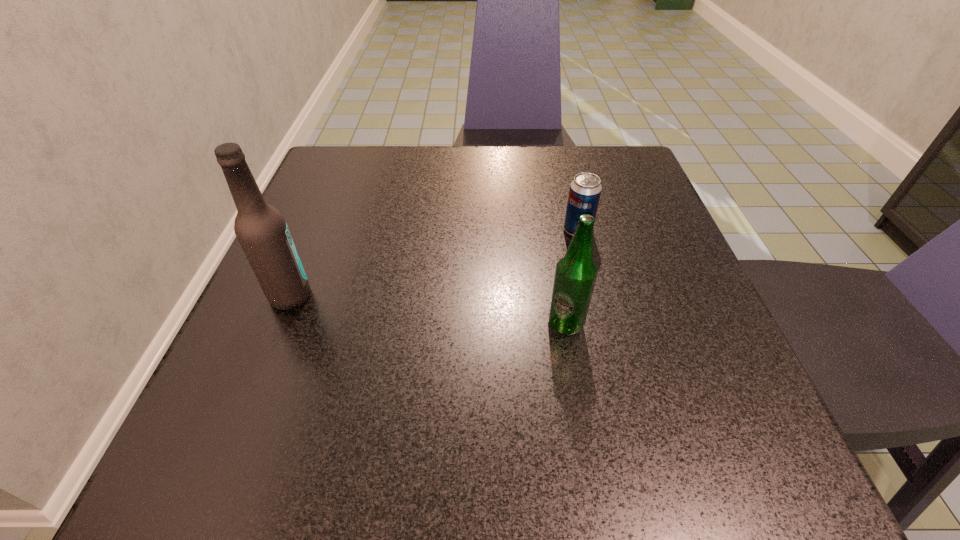
At what (x,y) coordinates should I click in order to perform the action: click on object that is at the right edge. Please return your answer as a coordinate pair (x, y). The width and height of the screenshot is (960, 540). Looking at the image, I should click on (585, 190).

Where is `vacant space at the far edge of the desktop`? vacant space at the far edge of the desktop is located at coordinates (498, 165).

You are a GUI agent. You are given a task and a screenshot of the screen. Output one action in this format:
    pyautogui.click(x=<x>, y=<y>)
    Task: Click on the vacant space at the left edge
    
    Given the screenshot: What is the action you would take?
    pyautogui.click(x=341, y=216)

Find the location of a particular element. The width and height of the screenshot is (960, 540). free location at the right edge is located at coordinates (634, 301).

Find the location of a particular element. vacant region at the far left corner of the desktop is located at coordinates [x=322, y=172].

Where is `free region at the near left corner of the desktop`? This screenshot has width=960, height=540. free region at the near left corner of the desktop is located at coordinates (295, 460).

Locate an element on the screen. free region at the far right corner is located at coordinates (623, 170).

You are a GUI agent. You are given a task and a screenshot of the screen. Output one action in this format:
    pyautogui.click(x=<x>, y=<y>)
    Task: Click on the vacant space at the near right corner
    Image resolution: width=960 pixels, height=540 pixels.
    Given the screenshot: What is the action you would take?
    pyautogui.click(x=745, y=484)

This screenshot has width=960, height=540. Identify the location of free space that is in between the taller beer bottle and the second tallest object. (428, 310).

Where is `free spot between the taller beer bottle and the beer can`? The image size is (960, 540). free spot between the taller beer bottle and the beer can is located at coordinates (434, 263).